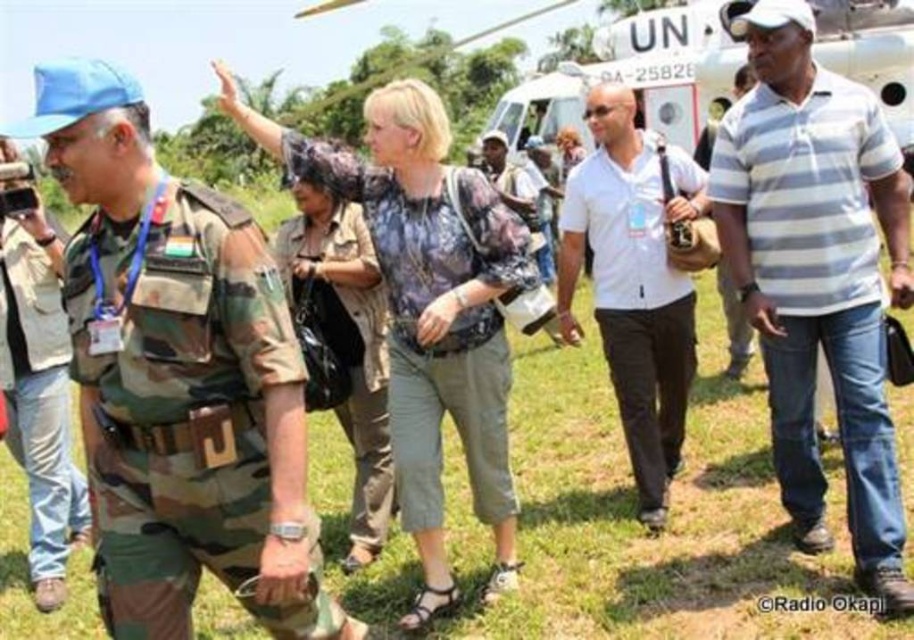
Measure the distance from white cotton polo shirt at center to white matte helicopter at upper center.

They are 7.41 meters apart.

Which is above, white cotton polo shirt at center or white matte helicopter at upper center?

white matte helicopter at upper center

The width and height of the screenshot is (914, 640). Find the location of `white cotton polo shirt at center`. white cotton polo shirt at center is located at coordinates (634, 282).

Is camouflage fabric uniform at center wider than camouflage uniform at center?

Indeed, camouflage fabric uniform at center has a greater width compared to camouflage uniform at center.

Can you confirm if camouflage fabric uniform at center is positioned below camouflage uniform at center?

No, camouflage fabric uniform at center is not below camouflage uniform at center.

Locate an element on the screen. This screenshot has width=914, height=640. camouflage fabric uniform at center is located at coordinates (428, 308).

Consider the image. Between camo uniform at left and white cotton polo shirt at center, which one is positioned lower?

camo uniform at left

Does camo uniform at left lie behind white cotton polo shirt at center?

No.

What do you see at coordinates (178, 378) in the screenshot?
I see `camo uniform at left` at bounding box center [178, 378].

Where is `camo uniform at left`? Image resolution: width=914 pixels, height=640 pixels. camo uniform at left is located at coordinates point(178,378).